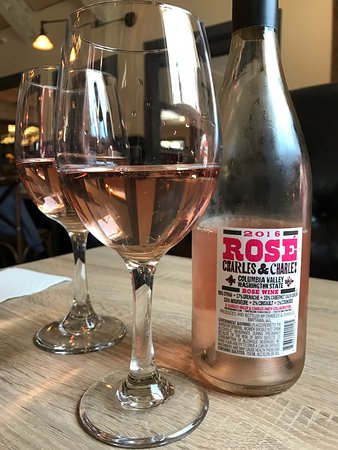
Find the location of a particular element. light fixture is located at coordinates point(42,43).